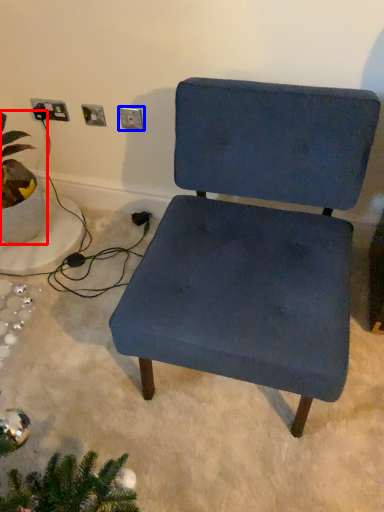
Question: Which object appears closest to the camera in this image, houseplant (highlighted by a red box) or electric outlet (highlighted by a blue box)?

Choices:
 (A) houseplant
 (B) electric outlet

Answer: (A)